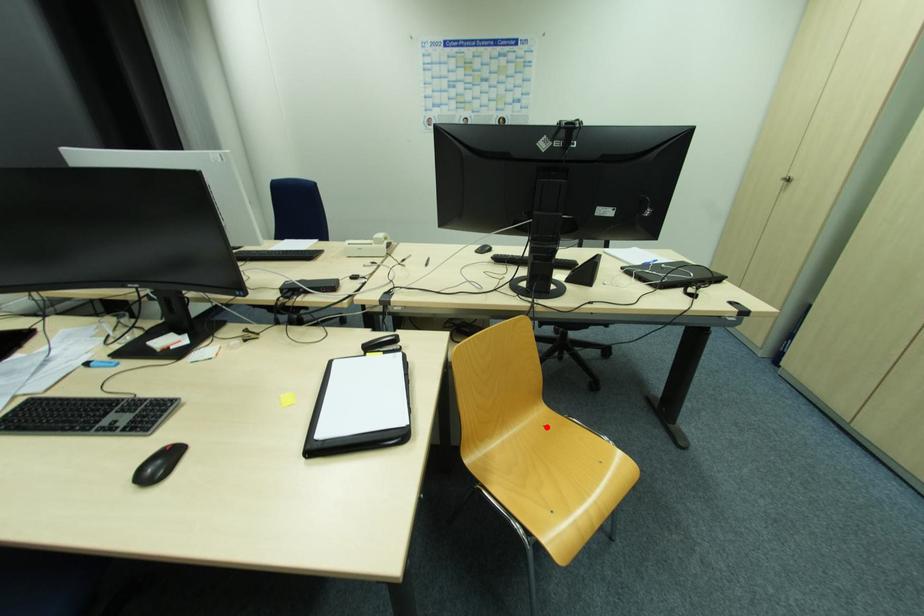
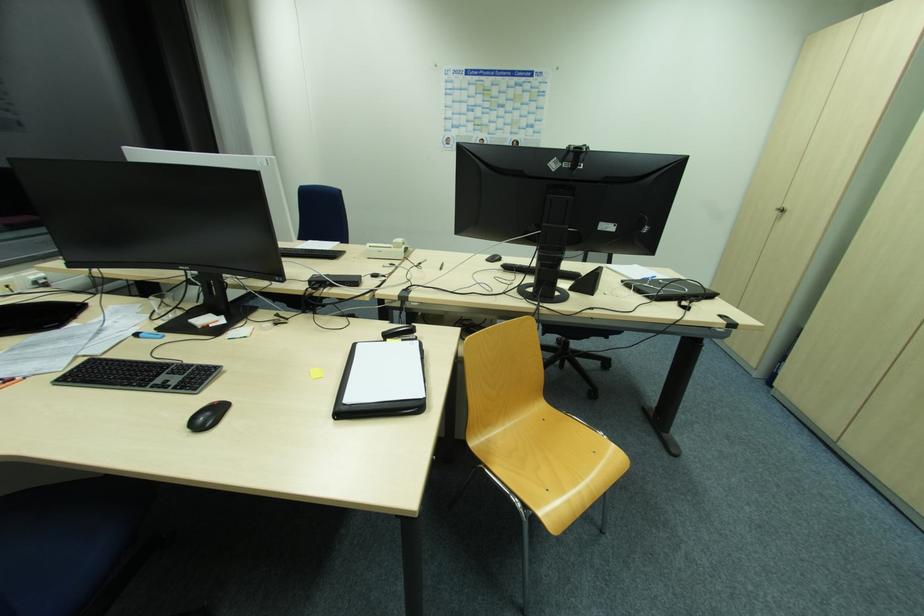
The point at the highlighted location is marked in the first image. Where is the corresponding point in the second image?

(545, 421)